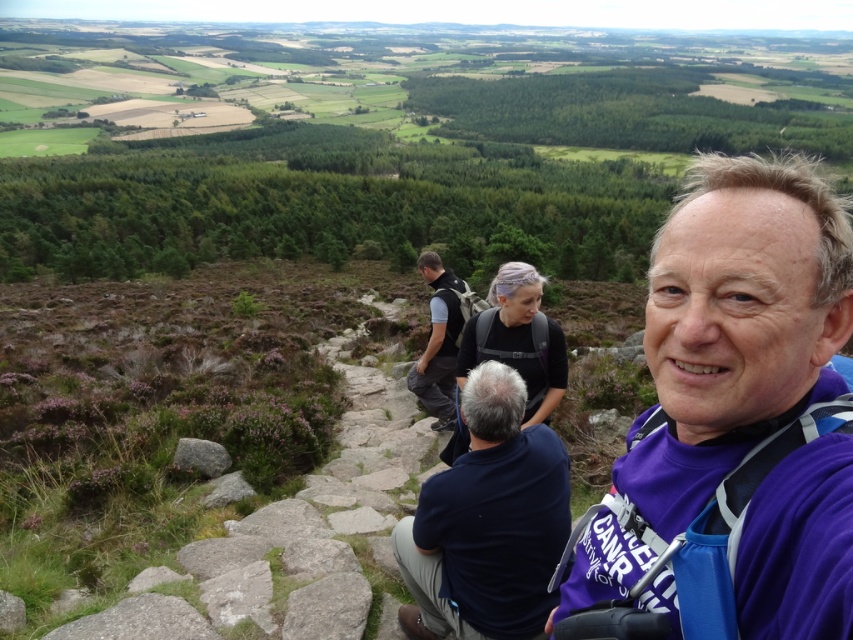
Does dark gray fabric backpack at center have a greater height compared to gray rough rock at lower left?

Yes, dark gray fabric backpack at center is taller than gray rough rock at lower left.

Where is `dark gray fabric backpack at center`? The height and width of the screenshot is (640, 853). dark gray fabric backpack at center is located at coordinates (438, 342).

Where is `dark gray fabric backpack at center`? The image size is (853, 640). dark gray fabric backpack at center is located at coordinates (438, 342).

Can you confirm if dark blue shirt at center is positioned below dark gray fabric backpack at center?

Yes.

Which is above, dark blue shirt at center or dark gray fabric backpack at center?

Positioned higher is dark gray fabric backpack at center.

Is point (461, 612) positioned in front of point (434, 298)?

Yes.

The image size is (853, 640). Identify the location of dark blue shirt at center. (486, 524).

Which is behind, point (796, 428) or point (183, 438)?

Positioned behind is point (183, 438).

Does purple fabric at center have a greater height compared to gray rough rock at lower left?

Yes, purple fabric at center is taller than gray rough rock at lower left.

The width and height of the screenshot is (853, 640). Find the location of `purple fabric at center`. purple fabric at center is located at coordinates point(734,420).

The image size is (853, 640). Identify the location of purple fabric at center. (734, 420).